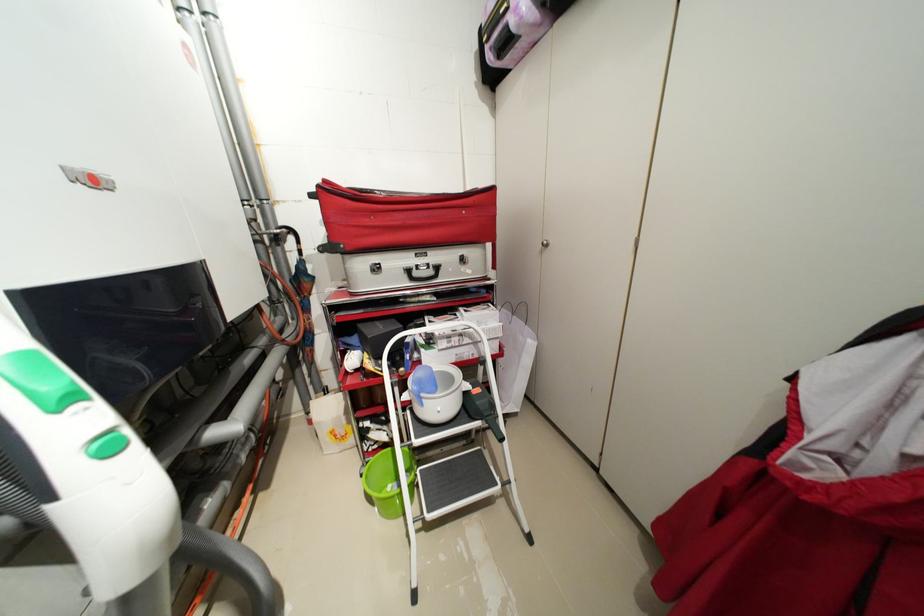
Find where to lift the white paper bag. Please return your answer as a coordinate pair (x, y).

(514, 361)